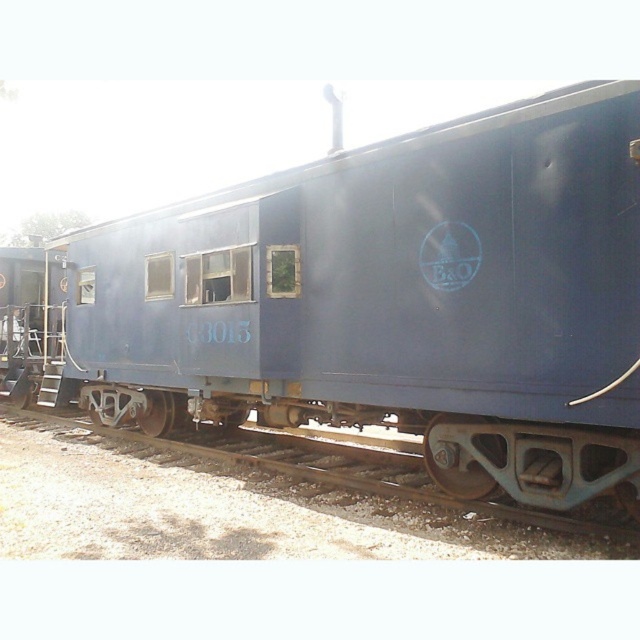
What are the coordinates of the blue matte train car at center?

The blue matte train car at center is located at coordinates point (x=376, y=300).

You are standing in front of the vintage train car. A small point is marked at coordinates (376, 300). Where is this point located?

The point is located on the blue matte train car at center.

You are a railway inspector checking the alignment of the train car and tracks. Based on the scene, which object is wider between the blue matte train car at center and the rusty metal track at lower center?

The blue matte train car at center is wider than the rusty metal track at lower center according to the description.